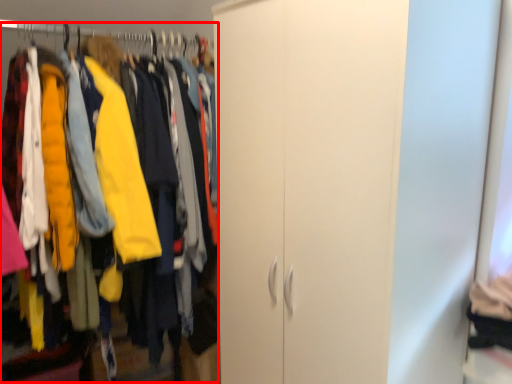
Question: From the image's perspective, where is closet (annotated by the red box) located relative to hanger?

Choices:
 (A) below
 (B) above

Answer: (A)